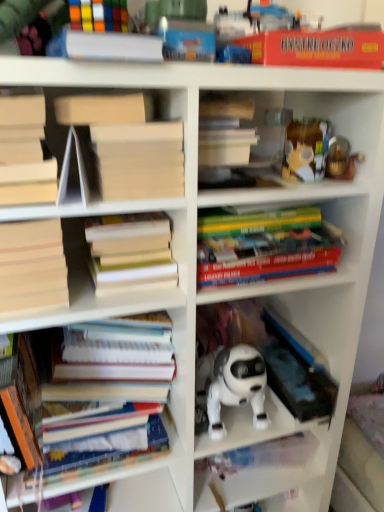
Question: Is translucent plastic container at upper right, arranged as the second toy when viewed from the right, facing away from white matte book at upper left, acting as the fifth book starting from the bottom?

Choices:
 (A) yes
 (B) no

Answer: (B)

Question: Can you confirm if translucent plastic container at upper right, arranged as the second toy when viewed from the right, is thinner than white matte book at upper left, placed as the third book when sorted from top to bottom?

Choices:
 (A) no
 (B) yes

Answer: (B)

Question: Can you confirm if translucent plastic container at upper right, arranged as the second toy when viewed from the right, is bigger than white matte book at upper left, acting as the fifth book starting from the bottom?

Choices:
 (A) yes
 (B) no

Answer: (B)

Question: From a real-world perspective, is translucent plastic container at upper right, which is counted as the 1th toy, starting from the left, beneath white matte book at upper left, acting as the fifth book starting from the bottom?

Choices:
 (A) yes
 (B) no

Answer: (A)

Question: Is translucent plastic container at upper right, arranged as the second toy when viewed from the right, not close to white matte book at upper left, placed as the third book when sorted from top to bottom?

Choices:
 (A) no
 (B) yes

Answer: (A)

Question: Does translucent plastic container at upper right, which is counted as the 1th toy, starting from the left, appear on the right side of white matte book at upper left, acting as the fifth book starting from the bottom?

Choices:
 (A) yes
 (B) no

Answer: (A)

Question: Is white matte paper at upper center, positioned as the 2th paperback book in right-to-left order, to the left of rubberized plastic toy at upper center from the viewer's perspective?

Choices:
 (A) no
 (B) yes

Answer: (A)

Question: Is white matte paper at upper center, the 1th paperback book from the left, smaller than rubberized plastic toy at upper center?

Choices:
 (A) yes
 (B) no

Answer: (A)

Question: Is rubberized plastic toy at upper center at the back of white matte paper at upper center, the 1th paperback book from the left?

Choices:
 (A) no
 (B) yes

Answer: (B)

Question: Can you confirm if white matte paper at upper center, the 1th paperback book from the left, is shorter than rubberized plastic toy at upper center?

Choices:
 (A) no
 (B) yes

Answer: (B)

Question: Is white matte paper at upper center, the 1th paperback book from the left, to the right of rubberized plastic toy at upper center from the viewer's perspective?

Choices:
 (A) yes
 (B) no

Answer: (A)

Question: Would you say white matte paper at upper center, the 1th paperback book from the left, is outside rubberized plastic toy at upper center?

Choices:
 (A) no
 (B) yes

Answer: (A)

Question: Is translucent plastic container at upper right, which is counted as the 1th toy, starting from the left, taller than hardcover books at center, which is the fourth book in bottom-to-top order?

Choices:
 (A) yes
 (B) no

Answer: (B)